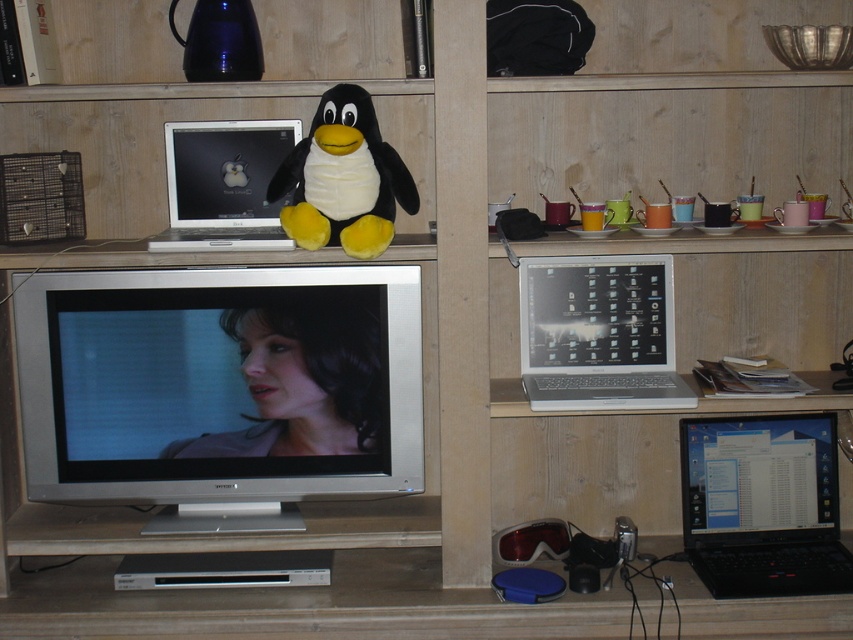
Between black glossy laptop at lower right and white soft plush penguin at center, which one has more height?

With more height is white soft plush penguin at center.

Who is shorter, black glossy laptop at lower right or white soft plush penguin at center?

black glossy laptop at lower right

Is point (782, 508) farther from viewer compared to point (387, 150)?

Yes, it is.

Image resolution: width=853 pixels, height=640 pixels. In order to click on black glossy laptop at lower right in this screenshot , I will do `click(763, 506)`.

Can you confirm if black glossy laptop at lower right is thinner than silver metallic laptop at center right?

Yes, black glossy laptop at lower right is thinner than silver metallic laptop at center right.

Does black glossy laptop at lower right appear over silver metallic laptop at center right?

No, black glossy laptop at lower right is not above silver metallic laptop at center right.

Where is `black glossy laptop at lower right`? Image resolution: width=853 pixels, height=640 pixels. black glossy laptop at lower right is located at coordinates (763, 506).

Between silver metallic laptop at center right and white soft plush penguin at center, which one appears on the right side from the viewer's perspective?

From the viewer's perspective, silver metallic laptop at center right appears more on the right side.

At what (x,y) coordinates should I click in order to perform the action: click on silver metallic laptop at center right. Please return your answer as a coordinate pair (x, y). Looking at the image, I should click on (599, 333).

Image resolution: width=853 pixels, height=640 pixels. Describe the element at coordinates (599, 333) in the screenshot. I see `silver metallic laptop at center right` at that location.

Where is `silver metallic laptop at center right`? This screenshot has height=640, width=853. silver metallic laptop at center right is located at coordinates (599, 333).